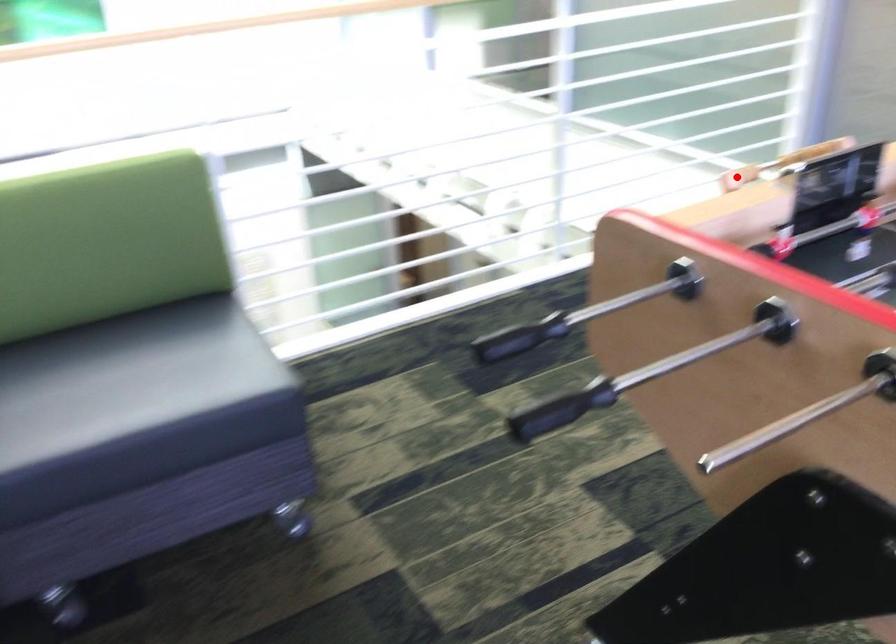
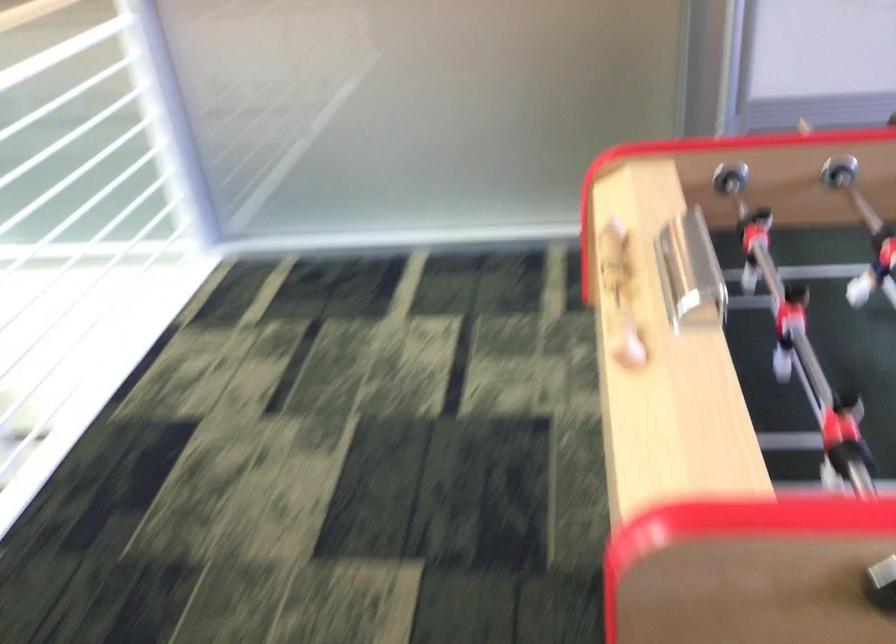
Question: I am providing you with two images of the same scene from different viewpoints. Given a red point in image1, look at the same physical point in image2. Is it:

Choices:
 (A) Closer to the viewpoint
 (B) Farther from the viewpoint

Answer: (A)